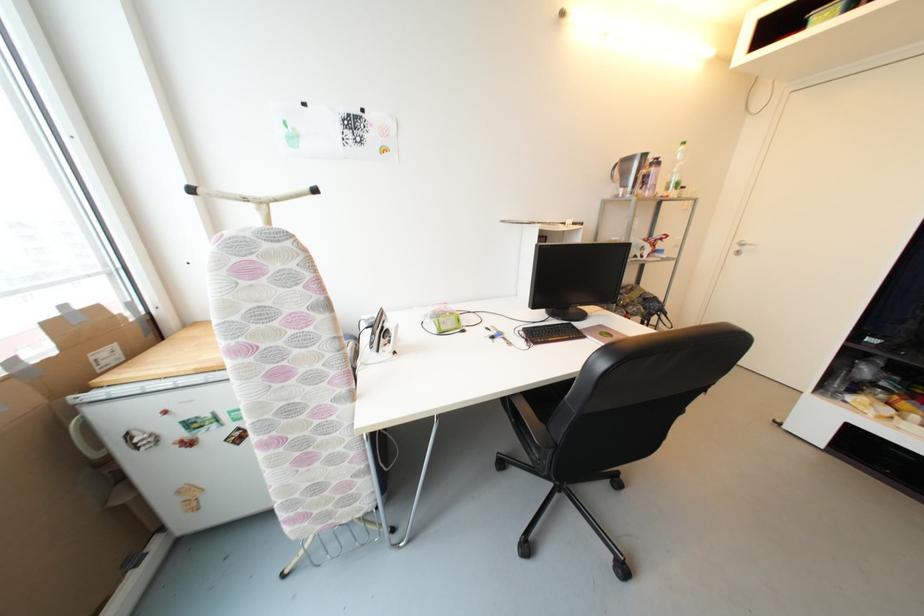
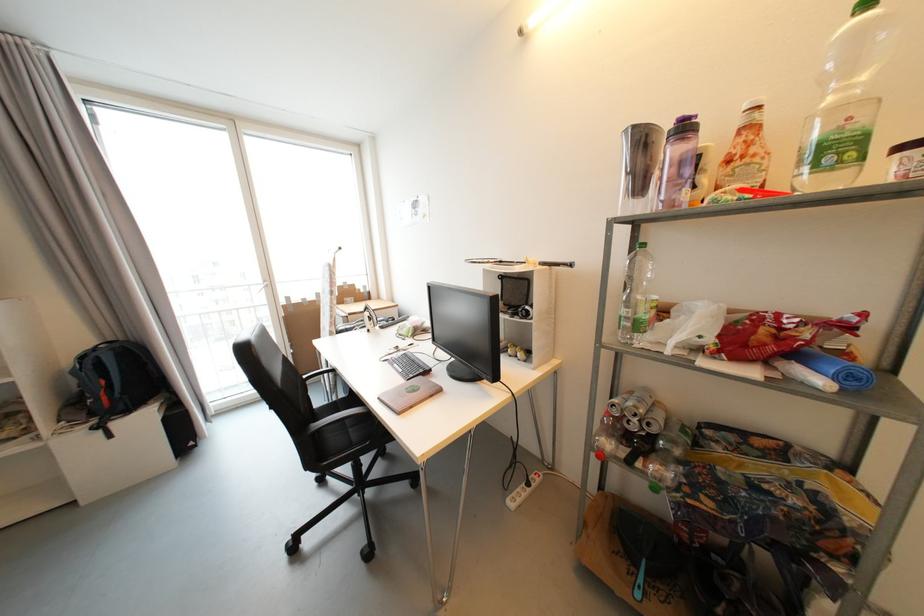
Where in the second image is the point corresponding to point (661, 164) from the first image?

(689, 130)